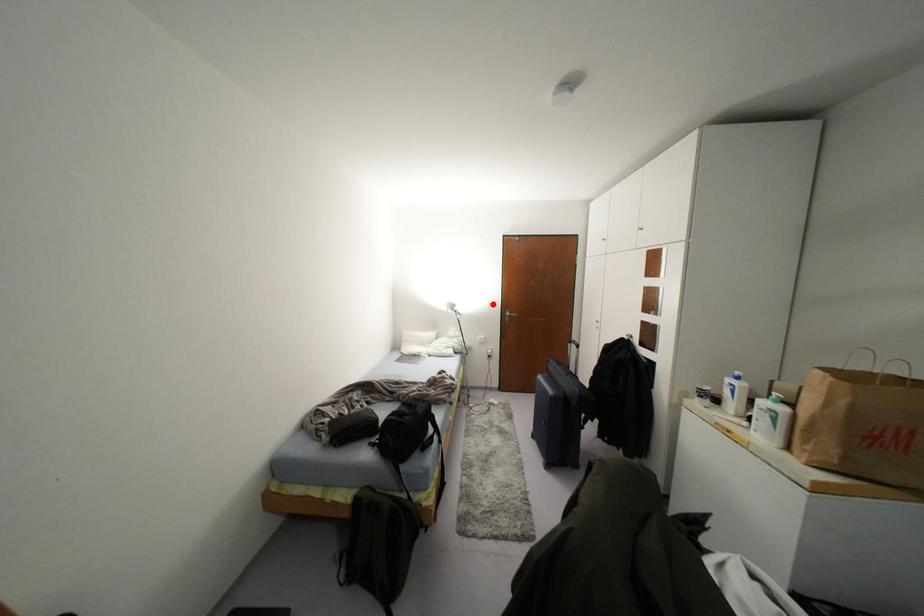
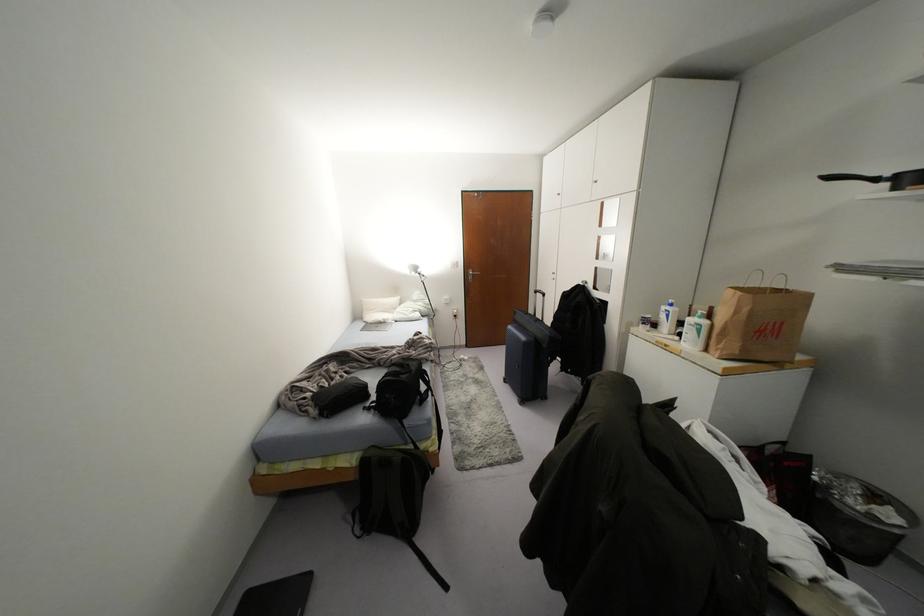
In the second image, find the point that corresponds to the highlighted location in the first image.

(456, 264)